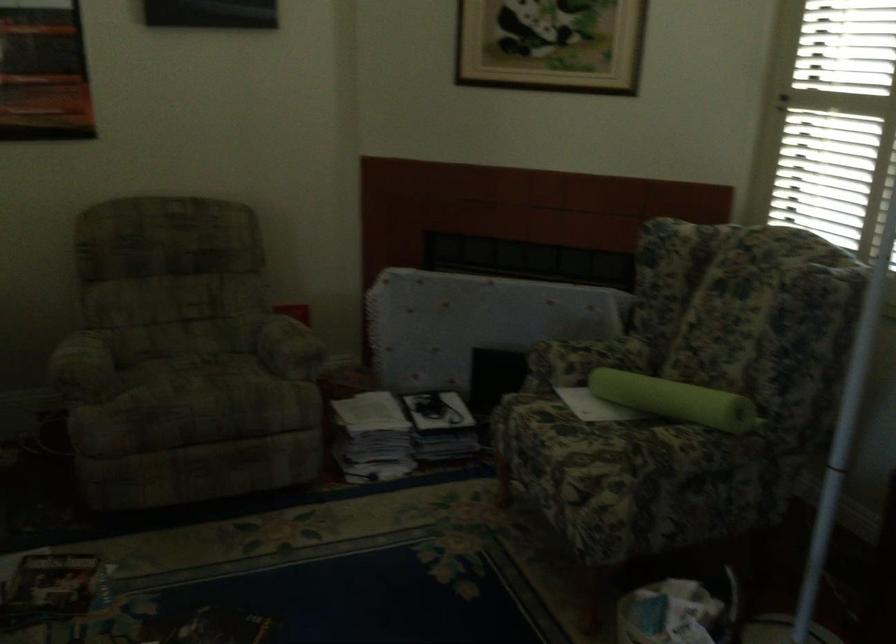
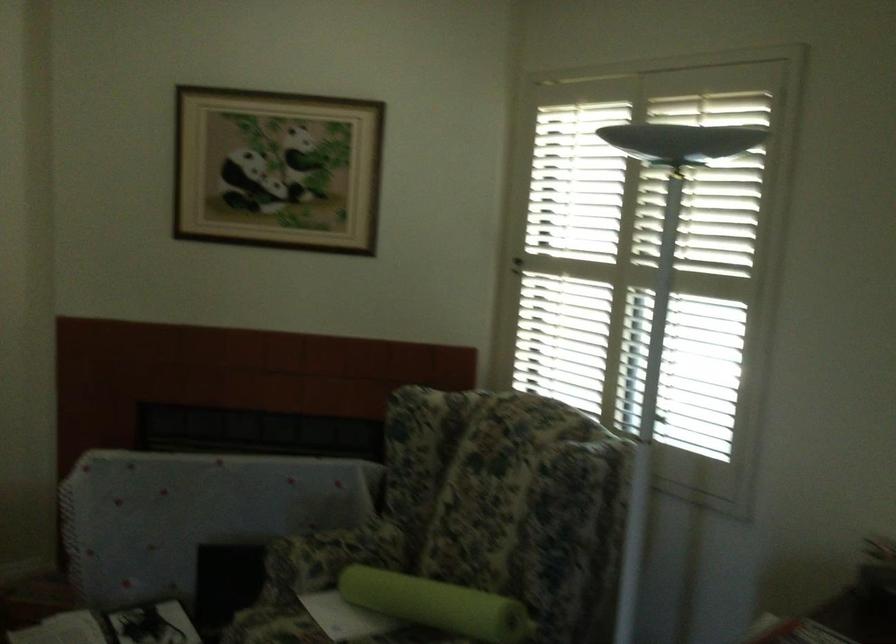
Question: Based on the continuous images, in which direction is the camera rotating? Reply with the corresponding letter.

Choices:
 (A) Left
 (B) Right
 (C) Up
 (D) Down

Answer: (B)